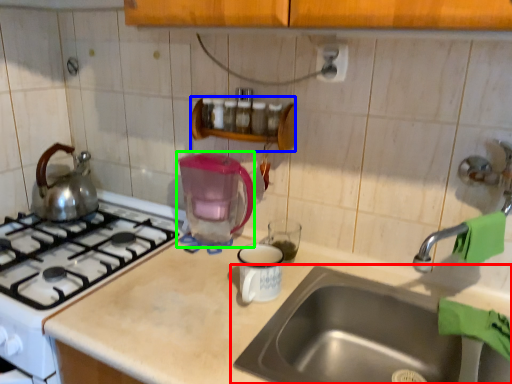
Question: Which object is the farthest from sink (highlighted by a red box)? Choose among these: shelf (highlighted by a blue box) or coffeepot (highlighted by a green box).

Choices:
 (A) shelf
 (B) coffeepot

Answer: (A)